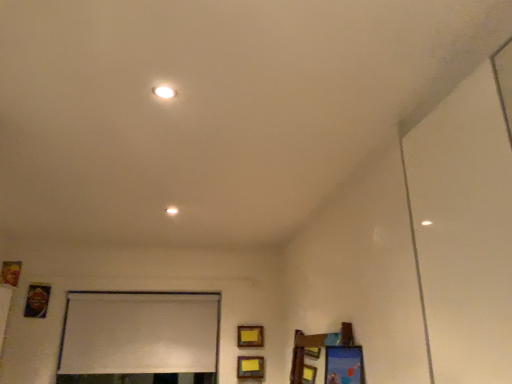
Question: Looking at the image, does matte yellow picture frame at center, the 2th picture frame from the bottom, seem bigger or smaller compared to white matte window screen at lower center?

Choices:
 (A) small
 (B) big

Answer: (A)

Question: From a real-world perspective, is matte yellow picture frame at center, the 2th picture frame from the bottom, positioned above or below white matte window screen at lower center?

Choices:
 (A) above
 (B) below

Answer: (B)

Question: Which is nearer to the white glossy light at upper center?

Choices:
 (A) white matte window screen at lower center
 (B) metallic gold picture frame at lower left, the 3th picture frame when ordered from right to left
 (C) matte yellow picture frame at lower center, the first picture frame positioned from the bottom
 (D) matte yellow picture frame at center, which appears as the fourth picture frame when viewed from the left
 (E) wooden picture frame at left, arranged as the first picture frame when viewed from the top

Answer: (D)

Question: Which is nearer to the white glossy light at upper center?

Choices:
 (A) wooden picture frame at left, the 4th picture frame when ordered from bottom to top
 (B) metallic gold picture frame at lower left, the 3th picture frame when ordered from right to left
 (C) white matte window screen at lower center
 (D) matte yellow picture frame at center, arranged as the 3th picture frame when viewed from the top
 (E) matte yellow picture frame at lower center, the third picture frame viewed from the left

Answer: (D)